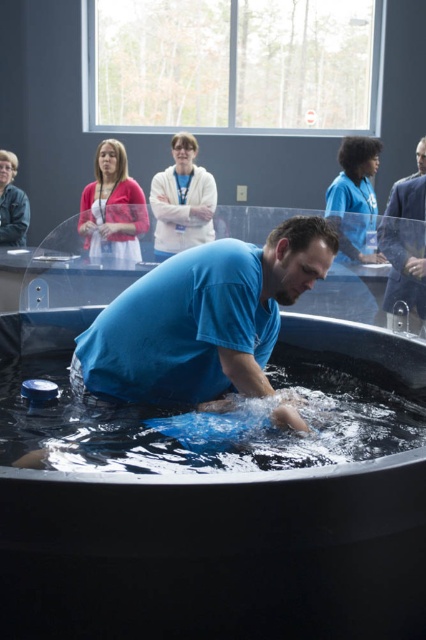
In the baptism scene, there is a man wearing a blue matte shirt at center and a large dark colored baptismal pool filled with water. If you were standing at the point with coordinates (201, 321), which object would you be directly facing?

The point at (201, 321) corresponds to the blue matte shirt at center, so you would be directly facing the blue matte shirt at center.

You are organizing a clothing donation drive and need to categorize shirts based on their size and texture. You have two shirts in front of you labeled as blue matte shirt at center and blue smooth shirt at right. Which shirt is smaller and has a matte texture?

The blue matte shirt at center is smaller than the blue smooth shirt at right and has a matte texture.

You are organizing a baptism event and need to place a decorative mat next to the black plastic tub at center and the matte pink cardigan at upper left. Which object requires a larger mat to cover its width?

The black plastic tub at center requires a larger mat because its width surpasses that of the matte pink cardigan at upper left.